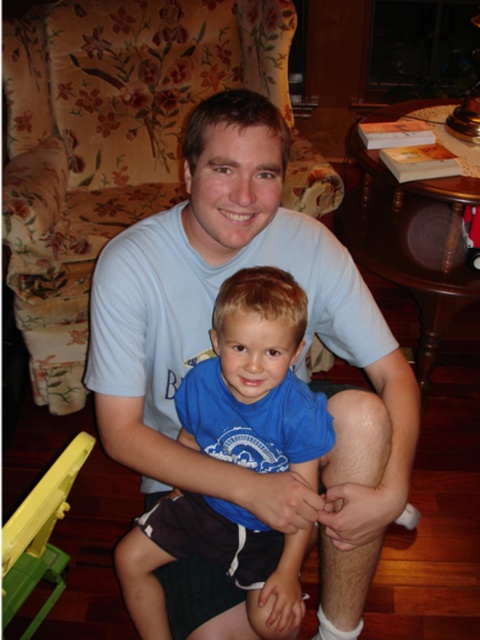
Question: Does light blue t-shirt at center have a lesser width compared to floral fabric armchair at upper left?

Choices:
 (A) no
 (B) yes

Answer: (B)

Question: Which of the following is the closest to the observer?

Choices:
 (A) (218, 573)
 (B) (8, 120)
 (C) (216, 556)

Answer: (C)

Question: Which point is closer to the camera?

Choices:
 (A) floral fabric armchair at upper left
 (B) light blue t-shirt at center
 (C) blue cotton shirt at center

Answer: (C)

Question: Is floral fabric armchair at upper left in front of blue cotton shirt at center?

Choices:
 (A) no
 (B) yes

Answer: (A)

Question: Is light blue t-shirt at center bigger than blue cotton shirt at center?

Choices:
 (A) no
 (B) yes

Answer: (B)

Question: Which object appears farthest from the camera in this image?

Choices:
 (A) light blue t-shirt at center
 (B) floral fabric armchair at upper left

Answer: (B)